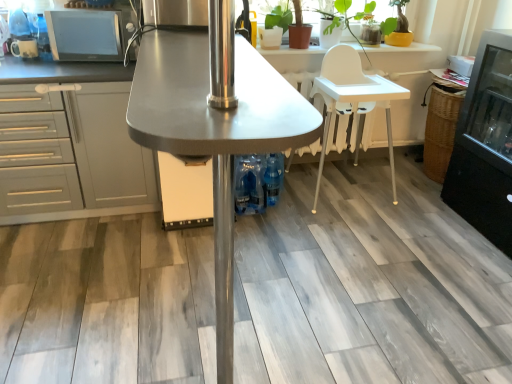
Find the location of a particular element. The image size is (512, 384). free space on the front side of blue plastic bottles at center is located at coordinates (273, 219).